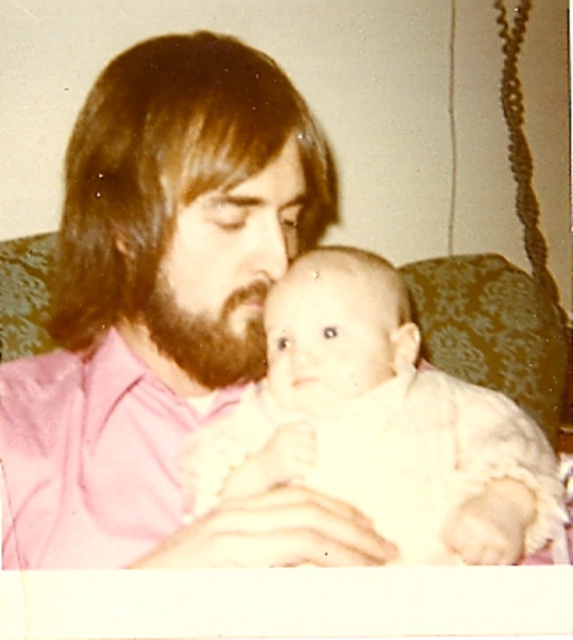
You are a photographer taking a portrait of the adult and baby. You need to ensure both the white fluffy baby at center and the dark brown fuzzy beard at center are clearly visible in the photo. Given their sizes, which one might require more careful framing to avoid being too large in the shot?

The white fluffy baby at center has a larger width than the dark brown fuzzy beard at center, so it might require more careful framing to avoid being too large in the shot.